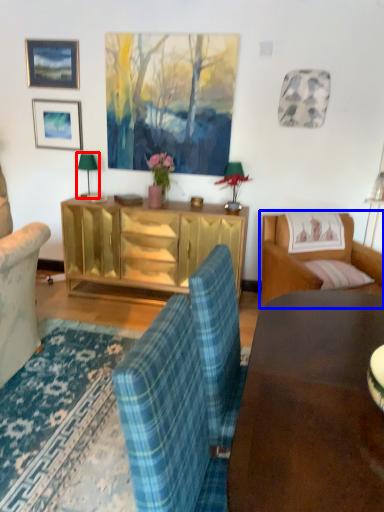
Question: Among these objects, which one is nearest to the camera, lamp (highlighted by a red box) or studio couch (highlighted by a blue box)?

Choices:
 (A) lamp
 (B) studio couch

Answer: (B)